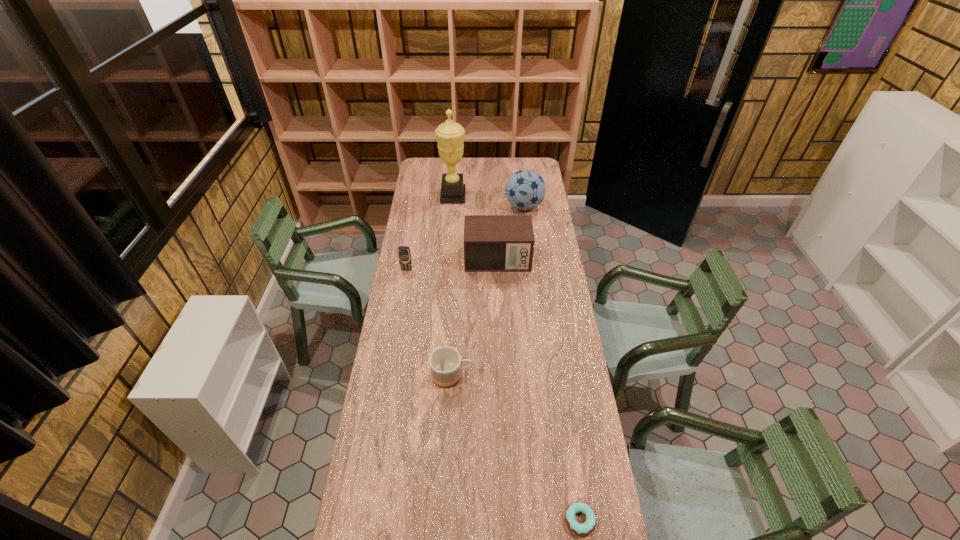
Image resolution: width=960 pixels, height=540 pixels. In the image, there is a desktop. Identify the location of free space at the far edge. (488, 160).

In the image, there is a desktop. What are the coordinates of `vacant space at the left edge` in the screenshot? It's located at (424, 291).

In the image, there is a desktop. Where is `free region at the right edge`? free region at the right edge is located at coordinates (569, 325).

This screenshot has width=960, height=540. Identify the location of vacant space at the far left corner of the desktop. (425, 177).

Image resolution: width=960 pixels, height=540 pixels. What are the coordinates of `vacant space at the far right corner of the desktop` in the screenshot? It's located at [537, 170].

Find the location of a particular element. unoccupied area between the trophy cup and the nearest object is located at coordinates (516, 358).

The width and height of the screenshot is (960, 540). Identify the location of free space between the radio receiver and the second nearest object. (475, 318).

The height and width of the screenshot is (540, 960). I want to click on free space that is in between the fourth tallest object and the nearest object, so click(x=493, y=395).

You are a GUI agent. You are given a task and a screenshot of the screen. Output one action in this format:
    pyautogui.click(x=<x>, y=<y>)
    Task: Click on the vacant area that lies between the cellular telephone and the shortest object
    
    Given the screenshot: What is the action you would take?
    pyautogui.click(x=493, y=395)

The width and height of the screenshot is (960, 540). I want to click on vacant area between the trophy cup and the nearest object, so click(516, 358).